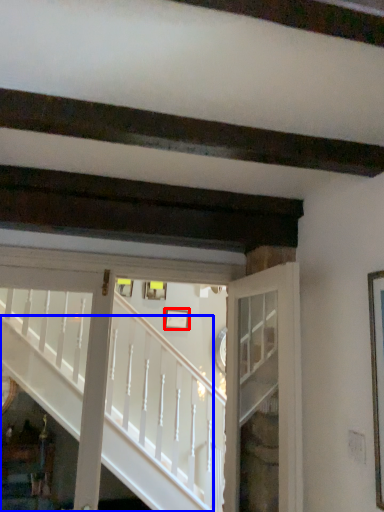
Question: Among these objects, which one is nearest to the camera, picture frame (highlighted by a red box) or stairs (highlighted by a blue box)?

Choices:
 (A) picture frame
 (B) stairs

Answer: (B)